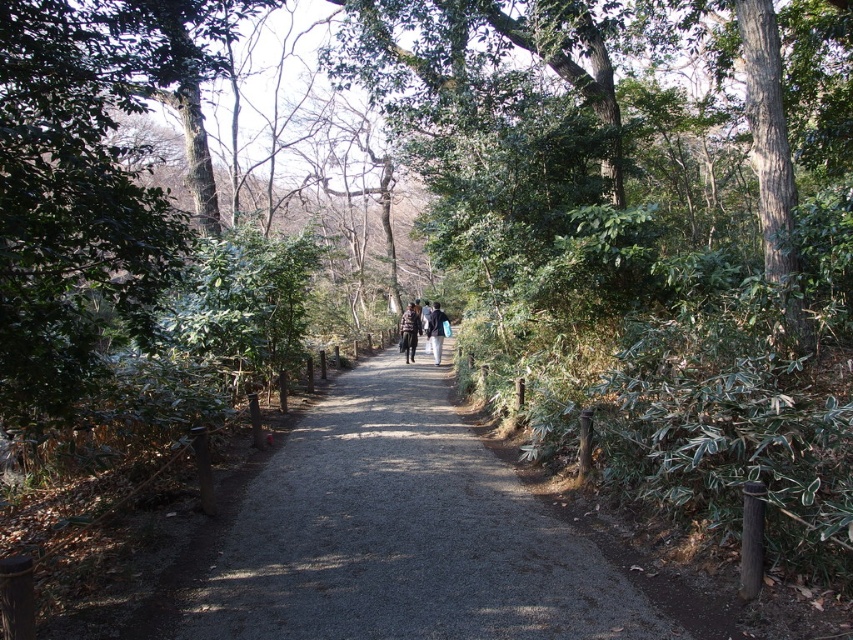
You are standing at the entrance of the forest path and want to walk along the gray gravel path at center. According to the coordinates provided, where exactly should you step to stay on the path?

The gray gravel path at center is located at coordinates point [392,538], so you should step there to stay on the path.

From the picture: You are a hiker who wants to place both jackets on a narrow bench that is 14 inches wide. Can you fit both the plaid fabric jacket at center and the dark blue jacket at center on the bench without overlapping?

The plaid fabric jacket at center and dark blue jacket at center are 14.15 inches apart from each other. Since the bench is only 14 inches wide, the jackets would overlap slightly, so they cannot fit without overlapping.

You are a hiker carrying a backpack and see the gray gravel path at center and the dark blue jacket at center. Which object is taller?

The dark blue jacket at center is taller than the gray gravel path at center.